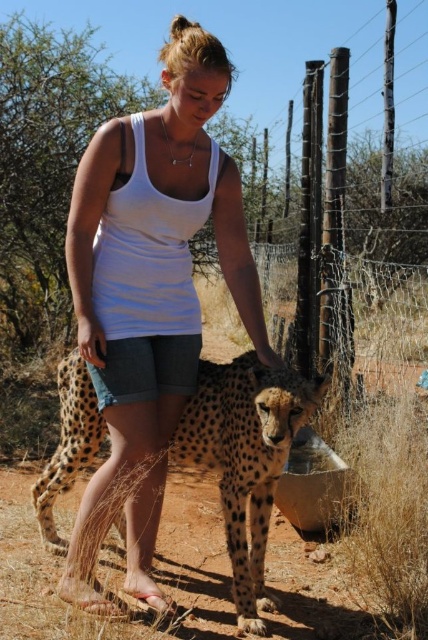
Question: Which point appears closest to the camera in this image?

Choices:
 (A) (198, 460)
 (B) (118, 196)

Answer: (B)

Question: Observing the image, what is the correct spatial positioning of white fabric tank top at center in reference to spotted fur cheetah at center?

Choices:
 (A) left
 (B) right

Answer: (A)

Question: Which object is closer to the camera taking this photo?

Choices:
 (A) white fabric tank top at center
 (B) spotted fur cheetah at center

Answer: (A)

Question: Can you confirm if white fabric tank top at center is positioned above spotted fur cheetah at center?

Choices:
 (A) yes
 (B) no

Answer: (A)

Question: Is white fabric tank top at center closer to camera compared to spotted fur cheetah at center?

Choices:
 (A) yes
 (B) no

Answer: (A)